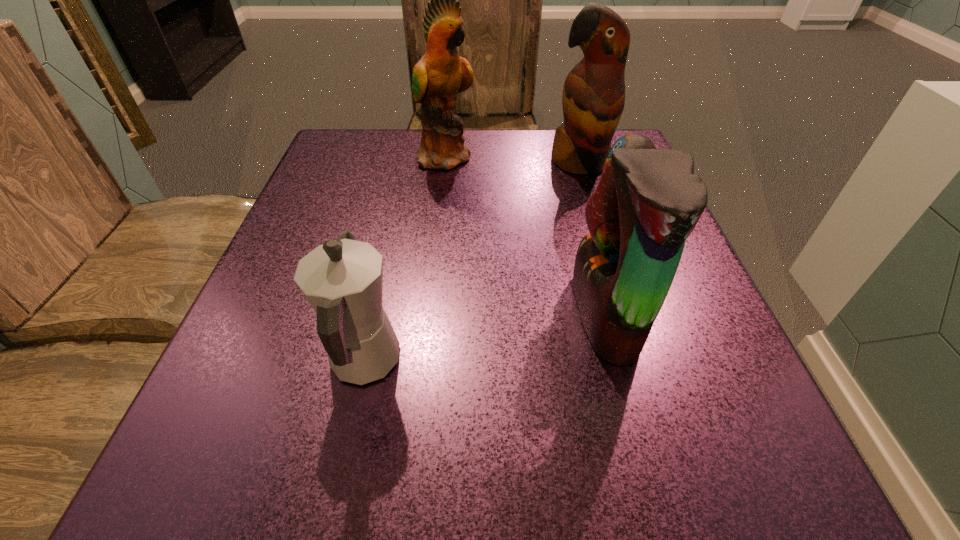
Find the location of a particular element. free point between the coffeepot and the shortest parrot is located at coordinates pos(485,338).

Locate an element on the screen. The image size is (960, 540). object that is the third closest to the leftmost parrot is located at coordinates (342, 279).

Where is `object that is the third closest to the second shortest object`? This screenshot has height=540, width=960. object that is the third closest to the second shortest object is located at coordinates (441, 74).

The width and height of the screenshot is (960, 540). I want to click on the closest parrot to the leftmost parrot, so click(x=593, y=98).

Select which parrot appears as the second closest to the leftmost parrot. Please provide its 2D coordinates. Your answer should be formatted as a tuple, i.e. [(x, y)], where the tuple contains the x and y coordinates of a point satisfying the conditions above.

[(648, 201)]